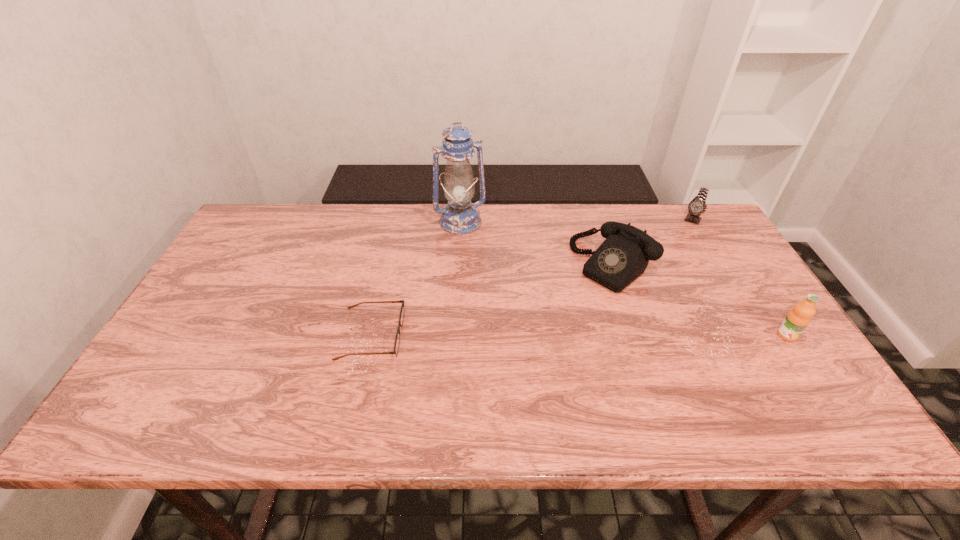
The width and height of the screenshot is (960, 540). In order to click on the shortest object in this screenshot , I will do `click(397, 340)`.

Identify the location of the leftmost object. (397, 340).

I want to click on the rightmost object, so click(x=798, y=318).

At what (x,y) coordinates should I click in order to perform the action: click on the third nearest object. Please return your answer as a coordinate pair (x, y). The width and height of the screenshot is (960, 540). Looking at the image, I should click on (624, 255).

Locate an element on the screen. Image resolution: width=960 pixels, height=540 pixels. telephone is located at coordinates (624, 255).

The height and width of the screenshot is (540, 960). Identify the location of the tallest object. (460, 216).

Find the location of a particular element. This screenshot has height=540, width=960. the fourth object from right to left is located at coordinates (460, 216).

I want to click on the fourth object from left to right, so click(x=697, y=206).

This screenshot has height=540, width=960. In order to click on blank space located 0.210m on the front-facing side of the leftmost object in this screenshot , I will do `click(486, 334)`.

At what (x,y) coordinates should I click in order to perform the action: click on free location located on the dial of the third farthest object. Please return your answer as a coordinate pair (x, y). Looking at the image, I should click on (533, 340).